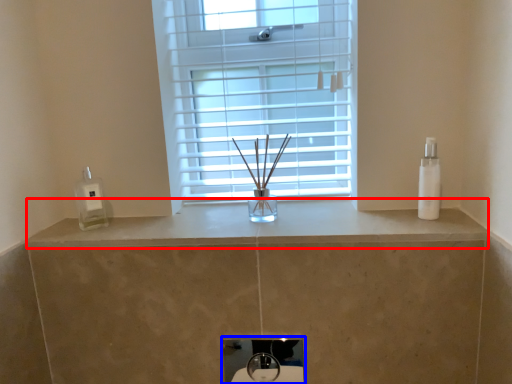
Question: Among these objects, which one is farthest to the camera, counter top (highlighted by a red box) or sink (highlighted by a blue box)?

Choices:
 (A) counter top
 (B) sink

Answer: (B)